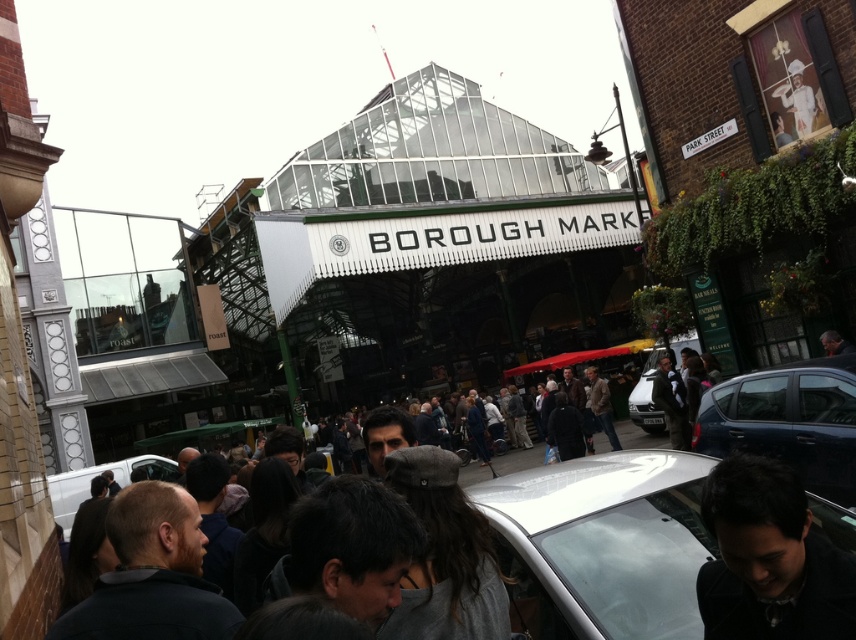
You are a photographer standing at the entrance of Borough Market. You want to take a photo of the dark brown leather jacket at center and the silver metallic van at center. Which object should you focus on first if you want to capture both in the same frame without moving your camera?

The dark brown leather jacket at center has a lesser height compared to the silver metallic van at center, so you should focus on the silver metallic van at center first as it is taller and will require more attention to ensure it fits properly in the frame.